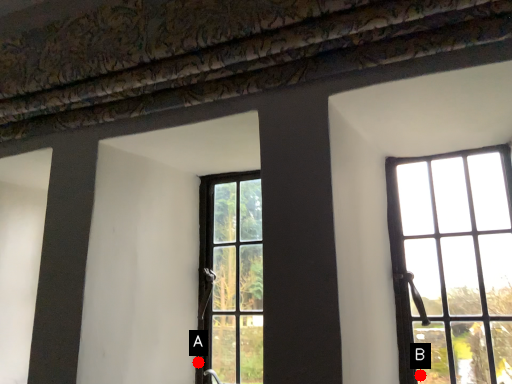
Question: Two points are circled on the image, labeled by A and B beside each circle. Which point appears farthest from the camera in this image?

Choices:
 (A) A is further
 (B) B is further

Answer: (A)